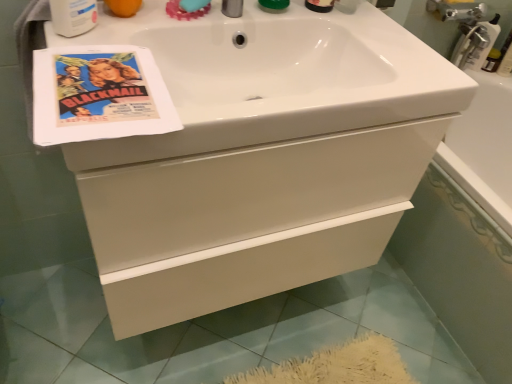
Find the location of a particular element. free area in between vintage paper flyer at upper left and white plastic mouthwash at upper left is located at coordinates (93, 43).